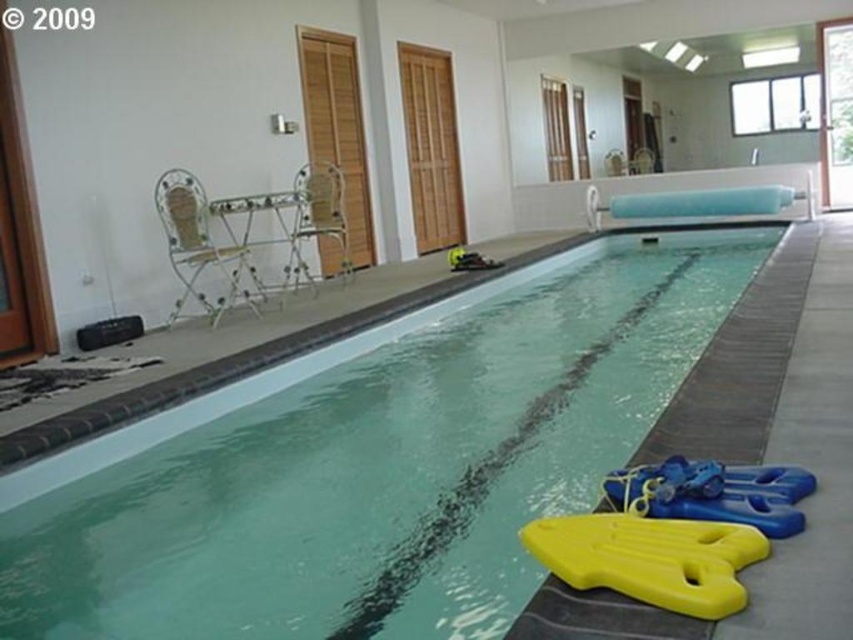
You are a swimmer preparing for a lesson and see both the yellow foam float at lower right and the yellow plastic float at lower right on the pool deck. Which one is positioned closer to the left side of the deck?

The yellow foam float at lower right is positioned to the left of the yellow plastic float at lower right, so it is closer to the left side of the deck.

You are a swimmer preparing for a lesson and notice two floats at the lower right corner of the pool deck. Which one is positioned lower between the yellow foam float at lower right and the yellow plastic float at lower right?

The yellow foam float at lower right is positioned lower than the yellow plastic float at lower right.